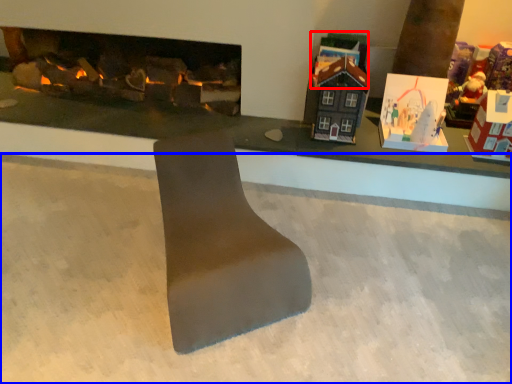
Question: Which of the following is the farthest to the observer, toy (highlighted by a red box) or concrete (highlighted by a blue box)?

Choices:
 (A) toy
 (B) concrete

Answer: (A)